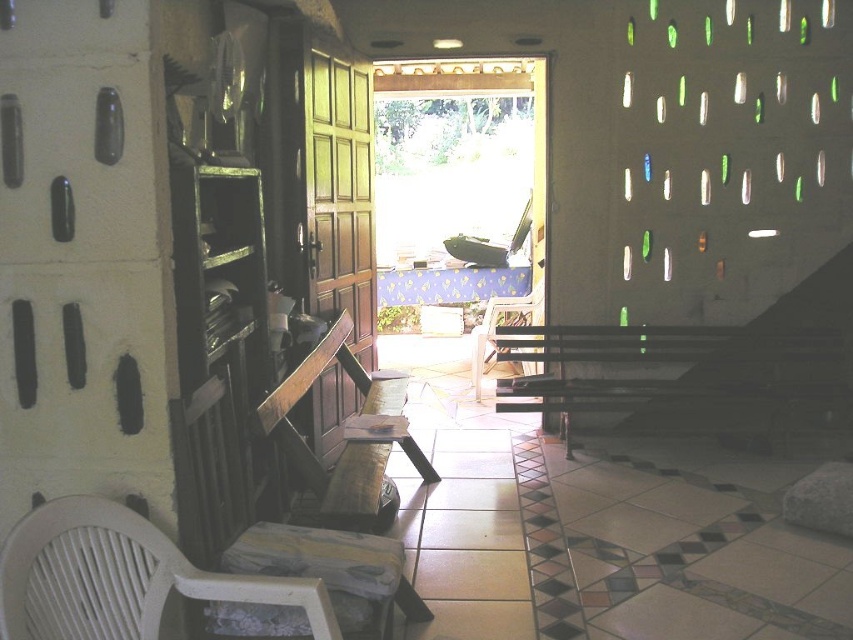
Question: Which of the following is the farthest from the observer?

Choices:
 (A) green wood door at center
 (B) wooden chair at center
 (C) white plastic rocking chair at lower left
 (D) wooden bench at center

Answer: (B)

Question: From the image, what is the correct spatial relationship of white plastic rocking chair at lower left in relation to wooden bench at center?

Choices:
 (A) left
 (B) right

Answer: (A)

Question: Which of the following is the closest to the observer?

Choices:
 (A) (541, 307)
 (B) (335, 356)

Answer: (B)

Question: Which object is farther from the camera taking this photo?

Choices:
 (A) wooden bench at center
 (B) green wood door at center

Answer: (B)

Question: Is white plastic rocking chair at lower left positioned before wooden chair at center?

Choices:
 (A) no
 (B) yes

Answer: (B)

Question: Considering the relative positions of green wood door at center and wooden bench at center in the image provided, where is green wood door at center located with respect to wooden bench at center?

Choices:
 (A) above
 (B) below

Answer: (A)